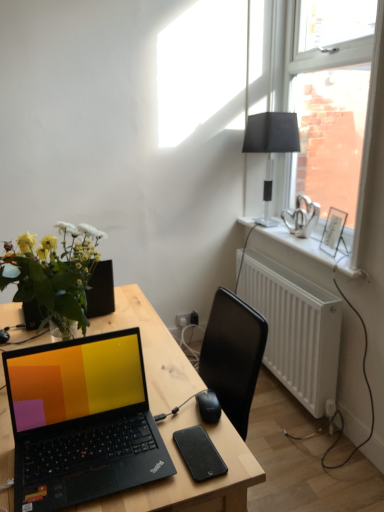
This screenshot has width=384, height=512. In order to click on free space to the left of black matte tablet at center in this screenshot , I will do `click(138, 458)`.